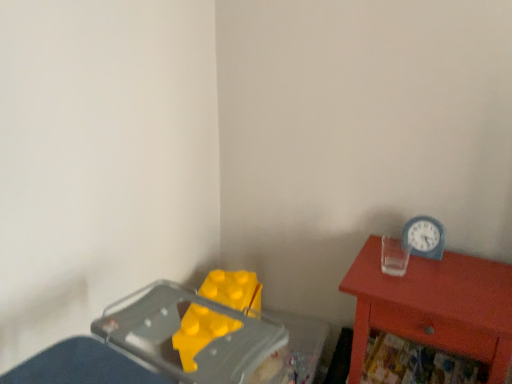
Question: Is the depth of blue plastic clock at upper right greater than that of matte red nightstand at right?

Choices:
 (A) no
 (B) yes

Answer: (B)

Question: Is blue plastic clock at upper right aimed at matte red nightstand at right?

Choices:
 (A) yes
 (B) no

Answer: (B)

Question: From a real-world perspective, is blue plastic clock at upper right physically below matte red nightstand at right?

Choices:
 (A) yes
 (B) no

Answer: (B)

Question: Considering the relative positions of blue plastic clock at upper right and matte red nightstand at right in the image provided, is blue plastic clock at upper right to the right of matte red nightstand at right from the viewer's perspective?

Choices:
 (A) yes
 (B) no

Answer: (B)

Question: From the image's perspective, would you say blue plastic clock at upper right is positioned over matte red nightstand at right?

Choices:
 (A) no
 (B) yes

Answer: (B)

Question: Is blue plastic clock at upper right facing away from matte red nightstand at right?

Choices:
 (A) yes
 (B) no

Answer: (B)

Question: Is matte red nightstand at right positioned behind blue plastic clock at upper right?

Choices:
 (A) yes
 (B) no

Answer: (B)

Question: Considering the relative sizes of matte red nightstand at right and blue plastic clock at upper right in the image provided, is matte red nightstand at right smaller than blue plastic clock at upper right?

Choices:
 (A) yes
 (B) no

Answer: (B)

Question: Does matte red nightstand at right have a larger size compared to blue plastic clock at upper right?

Choices:
 (A) no
 (B) yes

Answer: (B)

Question: Is blue plastic clock at upper right at the back of matte red nightstand at right?

Choices:
 (A) no
 (B) yes

Answer: (A)

Question: Is matte red nightstand at right thinner than blue plastic clock at upper right?

Choices:
 (A) yes
 (B) no

Answer: (B)

Question: Considering the relative positions of matte red nightstand at right and blue plastic clock at upper right in the image provided, is matte red nightstand at right to the right of blue plastic clock at upper right from the viewer's perspective?

Choices:
 (A) no
 (B) yes

Answer: (B)

Question: Based on their positions, is matte red nightstand at right located to the left or right of blue plastic clock at upper right?

Choices:
 (A) left
 (B) right

Answer: (B)